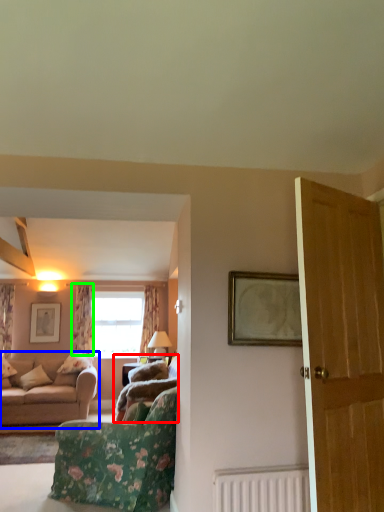
Question: Estimate the real-world distances between objects in this image. Which object is farther from studio couch (highlighted by a red box), studio couch (highlighted by a blue box) or curtain (highlighted by a green box)?

Choices:
 (A) studio couch
 (B) curtain

Answer: (B)